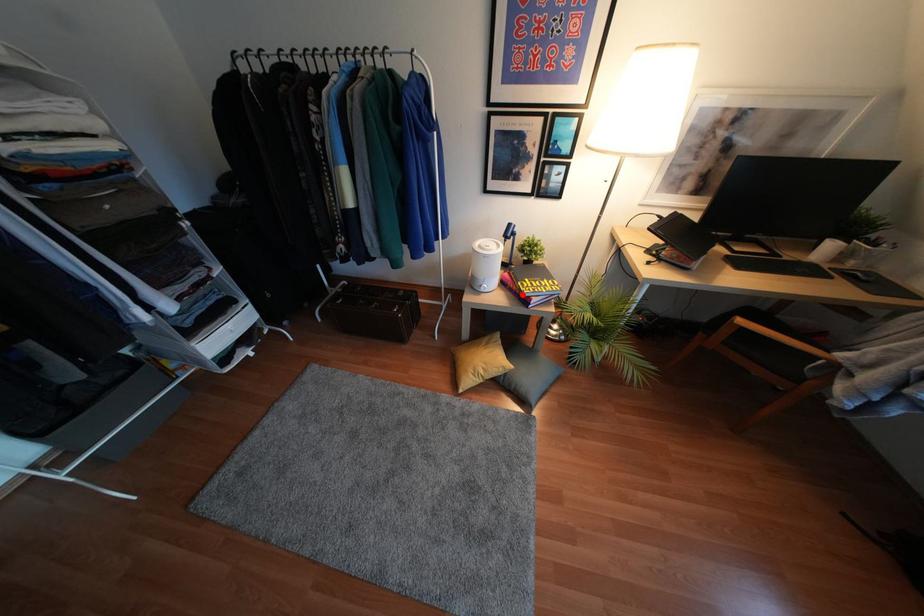
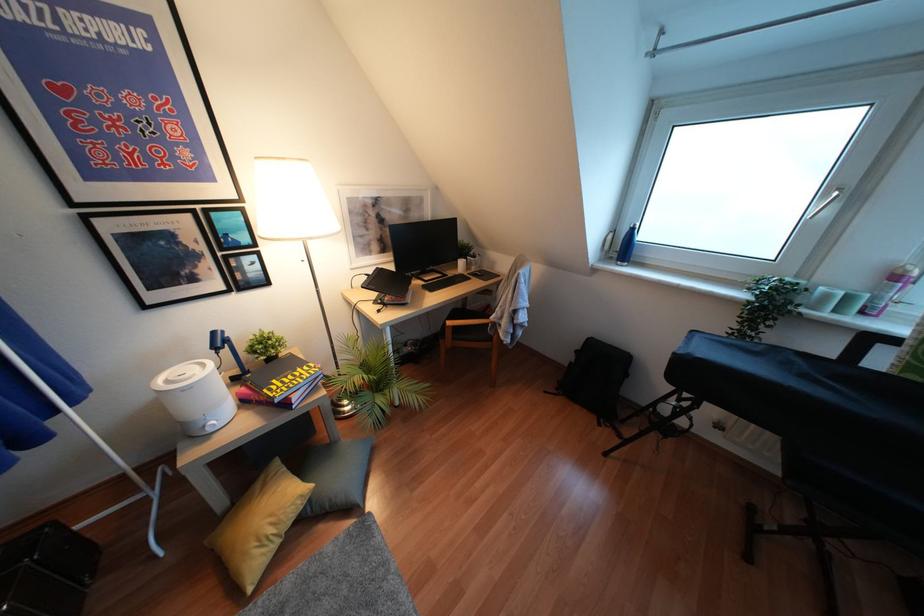
Where in the second image is the point corresponding to the highlighted location from the first image?

(275, 400)